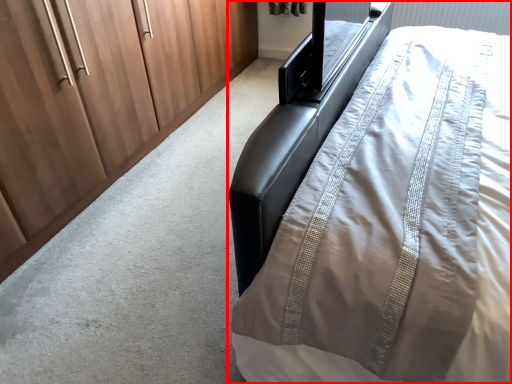
Question: Where is bed (annotated by the red box) located in relation to cupboard in the image?

Choices:
 (A) right
 (B) left

Answer: (A)